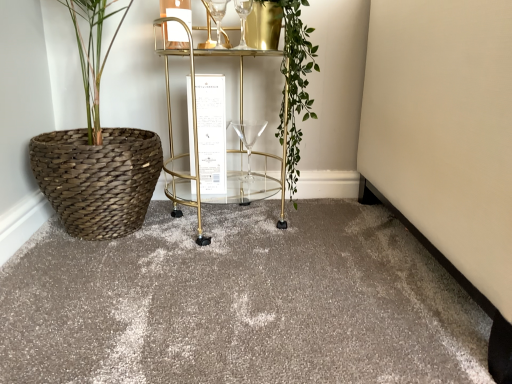
Identify the location of transparent glass wine glass at center, which is the 2th wine glass from front to back. (248, 138).

What do you see at coordinates (248, 138) in the screenshot? Image resolution: width=512 pixels, height=384 pixels. I see `transparent glass wine glass at center, which appears as the first wine glass when ordered from the bottom` at bounding box center [248, 138].

The height and width of the screenshot is (384, 512). In order to click on green leafy plant at center in this screenshot , I will do `click(295, 79)`.

Considering the positions of objects green leafy plant at center and gold metallic bar cart at center in the image provided, who is more to the left, green leafy plant at center or gold metallic bar cart at center?

gold metallic bar cart at center.

What are the coordinates of `vegetation located above the gold metallic bar cart at center (from the image's perspective)` in the screenshot? It's located at (295, 79).

Does point (297, 160) lie in front of point (284, 155)?

No.

Between green leafy plant at center and gold metallic bar cart at center, which one is positioned in front?

Positioned in front is gold metallic bar cart at center.

From the image's perspective, which is above, matte gray carpet at center or transparent glass wine glass at center, which is the 2th wine glass from front to back?

transparent glass wine glass at center, which is the 2th wine glass from front to back, from the image's perspective.

Find the location of `the 1st wine glass located above the matte gray carpet at center (from a real-world perspective)`. the 1st wine glass located above the matte gray carpet at center (from a real-world perspective) is located at coordinates (248, 138).

Visually, is matte gray carpet at center positioned to the left or to the right of transparent glass wine glass at center, arranged as the 2th wine glass when viewed from the top?

Clearly, matte gray carpet at center is on the left of transparent glass wine glass at center, arranged as the 2th wine glass when viewed from the top, in the image.

Does matte gray carpet at center contain transparent glass wine glass at center, arranged as the 2th wine glass when viewed from the top?

Actually, transparent glass wine glass at center, arranged as the 2th wine glass when viewed from the top, is outside matte gray carpet at center.

In the image, there is a clear glass wine glass at upper center, the second wine glass in the bottom-to-top sequence. Identify the location of wine glass below it (from the image's perspective). This screenshot has width=512, height=384. (248, 138).

Considering the positions of points (232, 124) and (207, 9), is point (232, 124) closer to camera compared to point (207, 9)?

No, it is not.

In the scene shown: Is transparent glass wine glass at center, the first wine glass viewed from the back, in front of or behind clear glass wine glass at upper center, the second wine glass in the bottom-to-top sequence, in the image?

transparent glass wine glass at center, the first wine glass viewed from the back, is positioned farther from the viewer than clear glass wine glass at upper center, the second wine glass in the bottom-to-top sequence.

Is transparent glass wine glass at center, the first wine glass viewed from the back, taller than clear glass wine glass at upper center, arranged as the second wine glass when viewed from the back?

Yes.

Is gold metallic bar cart at center to the left or to the right of clear glass wine glass at upper center, the second wine glass in the bottom-to-top sequence, in the image?

gold metallic bar cart at center is positioned on clear glass wine glass at upper center, the second wine glass in the bottom-to-top sequence,'s left side.

Considering the relative sizes of gold metallic bar cart at center and clear glass wine glass at upper center, marked as the 1th wine glass in a front-to-back arrangement, in the image provided, is gold metallic bar cart at center wider than clear glass wine glass at upper center, marked as the 1th wine glass in a front-to-back arrangement,?

Indeed, gold metallic bar cart at center has a greater width compared to clear glass wine glass at upper center, marked as the 1th wine glass in a front-to-back arrangement.

Could you measure the distance between gold metallic bar cart at center and clear glass wine glass at upper center, the second wine glass in the bottom-to-top sequence?

gold metallic bar cart at center and clear glass wine glass at upper center, the second wine glass in the bottom-to-top sequence, are 10.43 inches apart.

How different are the orientations of gold metallic bar cart at center and clear glass wine glass at upper center, marked as the 1th wine glass in a front-to-back arrangement, in degrees?

21.2 degrees separate the facing orientations of gold metallic bar cart at center and clear glass wine glass at upper center, marked as the 1th wine glass in a front-to-back arrangement.

Would you say gold metallic bar cart at center is part of matte gray carpet at center's contents?

No, gold metallic bar cart at center is located outside of matte gray carpet at center.

Is matte gray carpet at center aimed at gold metallic bar cart at center?

No, matte gray carpet at center is not turned towards gold metallic bar cart at center.

Considering the relative positions of matte gray carpet at center and gold metallic bar cart at center in the image provided, is matte gray carpet at center in front of gold metallic bar cart at center?

That is True.

From a real-world perspective, which object stands above the other?

In real-world perspective, green leafy plant at center is above.

Looking at this image, from the image's perspective, between matte gray carpet at center and green leafy plant at center, which one is located above?

green leafy plant at center, from the image's perspective.

Consider the image. Considering the positions of objects matte gray carpet at center and green leafy plant at center in the image provided, who is more to the left, matte gray carpet at center or green leafy plant at center?

matte gray carpet at center is more to the left.

You are a GUI agent. You are given a task and a screenshot of the screen. Output one action in this format:
    pyautogui.click(x=<x>, y=<y>)
    Task: Click on the vegetation behind the matte gray carpet at center
    This screenshot has height=384, width=512.
    Given the screenshot: What is the action you would take?
    pyautogui.click(x=295, y=79)

Based on the photo, considering the sizes of objects transparent glass wine glass at center, which is the 2th wine glass from front to back, and gold metallic bar cart at center in the image provided, who is thinner, transparent glass wine glass at center, which is the 2th wine glass from front to back, or gold metallic bar cart at center?

Thinner between the two is transparent glass wine glass at center, which is the 2th wine glass from front to back.

Which object is positioned more to the right, transparent glass wine glass at center, which is the 2th wine glass from front to back, or gold metallic bar cart at center?

Positioned to the right is transparent glass wine glass at center, which is the 2th wine glass from front to back.

Is transparent glass wine glass at center, which is the 2th wine glass from front to back, not inside gold metallic bar cart at center?

That's incorrect, transparent glass wine glass at center, which is the 2th wine glass from front to back, is not completely outside gold metallic bar cart at center.

Are transparent glass wine glass at center, which appears as the first wine glass when ordered from the bottom, and gold metallic bar cart at center far apart?

transparent glass wine glass at center, which appears as the first wine glass when ordered from the bottom, is near gold metallic bar cart at center, not far away.

This screenshot has height=384, width=512. I want to click on vegetation lying above the gold metallic bar cart at center (from the image's perspective), so click(295, 79).

Where is `concrete lying below the transparent glass wine glass at center, arranged as the 2th wine glass when viewed from the top (from the image's perspective)`? The width and height of the screenshot is (512, 384). concrete lying below the transparent glass wine glass at center, arranged as the 2th wine glass when viewed from the top (from the image's perspective) is located at coordinates (240, 303).

Looking at this image, considering their positions, is green leafy plant at center positioned further to clear glass wine glass at upper center, arranged as the second wine glass when viewed from the back, than transparent glass wine glass at center, the first wine glass viewed from the back?

transparent glass wine glass at center, the first wine glass viewed from the back, is positioned further to the anchor clear glass wine glass at upper center, arranged as the second wine glass when viewed from the back.

Looking at this image, which object lies nearer to the anchor point green leafy plant at center, transparent glass wine glass at center, which appears as the first wine glass when ordered from the bottom, or matte gray carpet at center?

The object closer to green leafy plant at center is transparent glass wine glass at center, which appears as the first wine glass when ordered from the bottom.

Which object lies further to the anchor point gold metallic bar cart at center, clear glass wine glass at upper center, the second wine glass in the bottom-to-top sequence, or transparent glass wine glass at center, the first wine glass viewed from the back?

clear glass wine glass at upper center, the second wine glass in the bottom-to-top sequence.

When comparing their distances from gold metallic bar cart at center, does matte gray carpet at center or transparent glass wine glass at center, which appears as the first wine glass when ordered from the bottom, seem closer?

transparent glass wine glass at center, which appears as the first wine glass when ordered from the bottom, lies closer to gold metallic bar cart at center than the other object.

In the scene shown: Based on their spatial positions, is gold metallic bar cart at center or transparent glass wine glass at center, which appears as the first wine glass when ordered from the bottom, further from matte gray carpet at center?

Among the two, transparent glass wine glass at center, which appears as the first wine glass when ordered from the bottom, is located further to matte gray carpet at center.

In the scene shown: Looking at the image, which one is located further to matte gray carpet at center, gold metallic bar cart at center or green leafy plant at center?

green leafy plant at center lies further to matte gray carpet at center than the other object.

Which object lies nearer to the anchor point gold metallic bar cart at center, transparent glass wine glass at center, which appears as the first wine glass when ordered from the bottom, or clear glass wine glass at upper center, arranged as the second wine glass when viewed from the back?

transparent glass wine glass at center, which appears as the first wine glass when ordered from the bottom.

From the image, which object appears to be farther from clear glass wine glass at upper center, arranged as the second wine glass when viewed from the back, gold metallic bar cart at center or green leafy plant at center?

green leafy plant at center lies further to clear glass wine glass at upper center, arranged as the second wine glass when viewed from the back, than the other object.

You are a GUI agent. You are given a task and a screenshot of the screen. Output one action in this format:
    pyautogui.click(x=<x>, y=<y>)
    Task: Click on the cart between green leafy plant at center and matte gray carpet at center in the up-down direction
    This screenshot has width=512, height=384.
    Given the screenshot: What is the action you would take?
    pyautogui.click(x=193, y=123)

Locate an element on the screen. The height and width of the screenshot is (384, 512). vegetation between clear glass wine glass at upper center, marked as the 1th wine glass in a front-to-back arrangement, and transparent glass wine glass at center, which appears as the first wine glass when ordered from the bottom, vertically is located at coordinates click(295, 79).

In order to click on vegetation between clear glass wine glass at upper center, marked as the 1th wine glass in a front-to-back arrangement, and gold metallic bar cart at center in the up-down direction in this screenshot , I will do `click(295, 79)`.

This screenshot has height=384, width=512. Find the location of `cart between clear glass wine glass at upper center, the second wine glass in the bottom-to-top sequence, and transparent glass wine glass at center, the first wine glass viewed from the back, in the up-down direction`. cart between clear glass wine glass at upper center, the second wine glass in the bottom-to-top sequence, and transparent glass wine glass at center, the first wine glass viewed from the back, in the up-down direction is located at coordinates (193, 123).